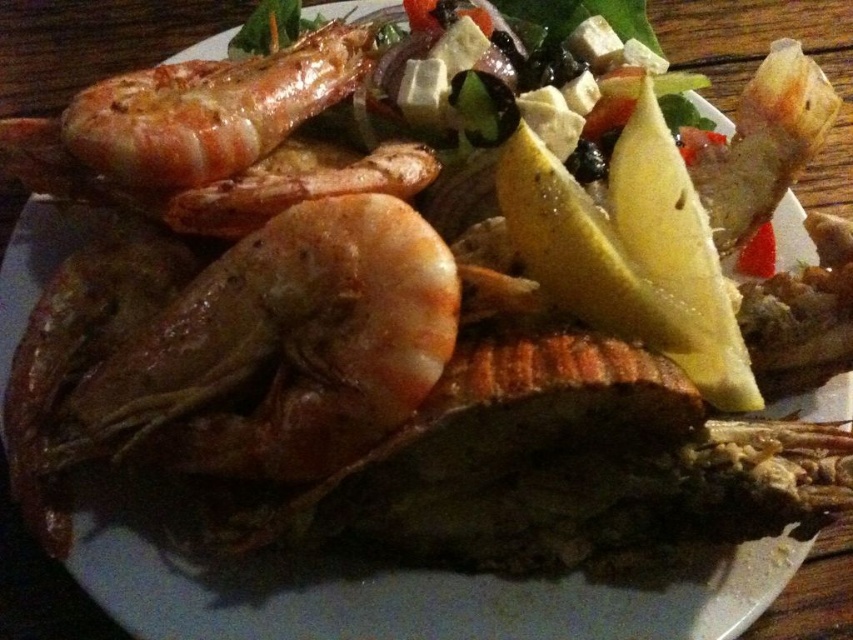
Question: Among these objects, which one is farthest from the camera?

Choices:
 (A) glossy orange shrimp at upper left
 (B) shiny brown shrimp at center
 (C) golden brown fried shrimp at center

Answer: (C)

Question: Is shiny brown shrimp at center positioned behind glossy orange shrimp at upper left?

Choices:
 (A) yes
 (B) no

Answer: (B)

Question: Which of these objects is positioned closest to the shiny brown shrimp at center?

Choices:
 (A) glossy orange shrimp at upper left
 (B) fresh green salad at upper center
 (C) golden brown fried shrimp at center

Answer: (C)

Question: Estimate the real-world distances between objects in this image. Which object is farther from the glossy orange shrimp at upper left?

Choices:
 (A) fresh green salad at upper center
 (B) golden brown fried shrimp at center

Answer: (A)

Question: Is shiny brown shrimp at center bigger than glossy orange shrimp at upper left?

Choices:
 (A) yes
 (B) no

Answer: (B)

Question: In this image, where is shiny brown shrimp at center located relative to glossy orange shrimp at upper left?

Choices:
 (A) right
 (B) left

Answer: (A)